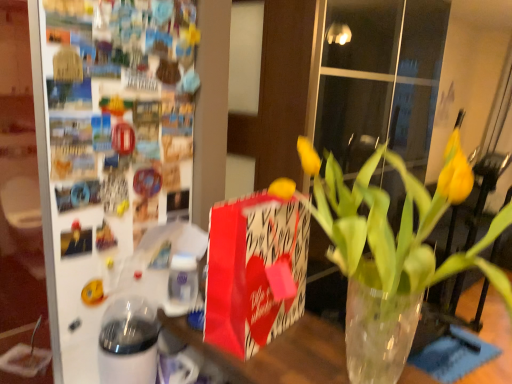
Question: Is red paper gift bag at center in front of translucent glass vase at center?

Choices:
 (A) yes
 (B) no

Answer: (B)

Question: Is red paper gift bag at center directly adjacent to translucent glass vase at center?

Choices:
 (A) yes
 (B) no

Answer: (B)

Question: Is red paper gift bag at center looking in the opposite direction of translucent glass vase at center?

Choices:
 (A) yes
 (B) no

Answer: (B)

Question: Is red paper gift bag at center bigger than translucent glass vase at center?

Choices:
 (A) yes
 (B) no

Answer: (A)

Question: Is red paper gift bag at center positioned beyond the bounds of translucent glass vase at center?

Choices:
 (A) yes
 (B) no

Answer: (A)

Question: Considering the relative positions of red paper gift bag at center and yellow matte vase at center in the image provided, is red paper gift bag at center to the left or to the right of yellow matte vase at center?

Choices:
 (A) left
 (B) right

Answer: (A)

Question: From a real-world perspective, is red paper gift bag at center above or below yellow matte vase at center?

Choices:
 (A) above
 (B) below

Answer: (B)

Question: In the image, is red paper gift bag at center positioned in front of or behind yellow matte vase at center?

Choices:
 (A) behind
 (B) front

Answer: (A)

Question: From the image's perspective, is red paper gift bag at center positioned above or below yellow matte vase at center?

Choices:
 (A) above
 (B) below

Answer: (B)

Question: Is point (154, 334) positioned closer to the camera than point (279, 226)?

Choices:
 (A) closer
 (B) farther

Answer: (B)

Question: Relative to red paper gift bag at center, is white glossy glass jar at lower left in front or behind?

Choices:
 (A) front
 (B) behind

Answer: (B)

Question: Looking at the image, does white glossy glass jar at lower left seem bigger or smaller compared to red paper gift bag at center?

Choices:
 (A) big
 (B) small

Answer: (B)

Question: Considering the positions of white glossy glass jar at lower left and red paper gift bag at center in the image, is white glossy glass jar at lower left wider or thinner than red paper gift bag at center?

Choices:
 (A) wide
 (B) thin

Answer: (B)

Question: Is yellow matte vase at center situated inside translucent glass vase at center or outside?

Choices:
 (A) inside
 (B) outside

Answer: (B)

Question: In terms of width, does yellow matte vase at center look wider or thinner when compared to translucent glass vase at center?

Choices:
 (A) thin
 (B) wide

Answer: (B)